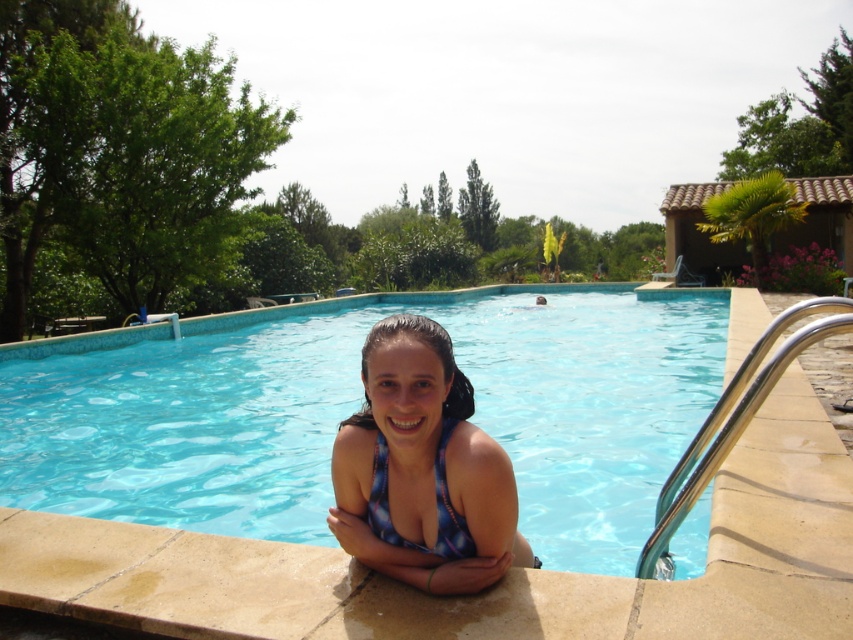
Is beige stone ledge at lower center positioned before blue printed bikini top at center?

Yes, beige stone ledge at lower center is closer to the viewer.

Who is more distant from viewer, (374, 634) or (387, 524)?

Point (387, 524)

What do you see at coordinates (421, 593) in the screenshot?
I see `beige stone ledge at lower center` at bounding box center [421, 593].

Locate an element on the screen. This screenshot has width=853, height=640. beige stone ledge at lower center is located at coordinates (421, 593).

Is blue glossy pool at center closer to the viewer compared to blue printed swimsuit at center?

No, it is behind blue printed swimsuit at center.

This screenshot has height=640, width=853. What are the coordinates of `blue glossy pool at center` in the screenshot? It's located at (358, 406).

Where is `blue glossy pool at center`? Image resolution: width=853 pixels, height=640 pixels. blue glossy pool at center is located at coordinates (358, 406).

In order to click on blue glossy pool at center in this screenshot , I will do `click(358, 406)`.

Who is positioned more to the right, blue printed swimsuit at center or blue printed bikini top at center?

blue printed bikini top at center is more to the right.

Between blue printed swimsuit at center and blue printed bikini top at center, which one is positioned lower?

→ blue printed swimsuit at center

What do you see at coordinates (422, 468) in the screenshot? I see `blue printed swimsuit at center` at bounding box center [422, 468].

The width and height of the screenshot is (853, 640). What are the coordinates of `blue printed swimsuit at center` in the screenshot? It's located at (422, 468).